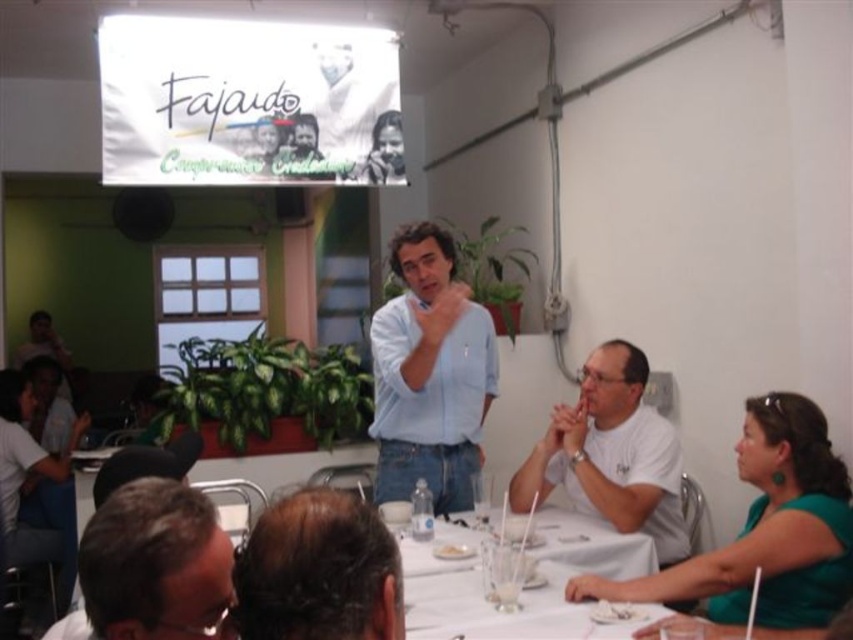
You are attending a virtual meeting and need to determine which attendee is wearing a shorter garment. The scene shows a group around a table with a green matte dress at lower right and a light blue shirt at center. Which attendee has a shorter garment?

The green matte dress at lower right is shorter than the light blue shirt at center, so the attendee wearing the green matte dress at lower right has the shorter garment.

You are standing at point (x=778, y=490) and want to reach the door located at the opposite corner of the room. The room is 3 meters wide. Can you walk straight to the door without crossing the table?

The distance between you and the door is 1.97 meters, which is less than the room width of 3 meters. However, the table is in the way, so you cannot walk straight to the door without crossing it.